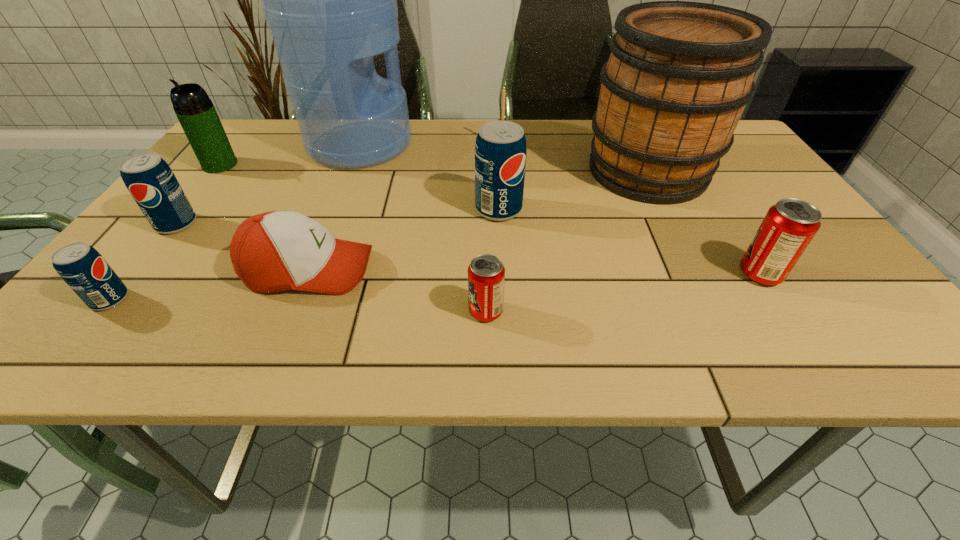
This screenshot has height=540, width=960. I want to click on the farther red soda can, so click(789, 226).

Find the location of a particular element. baseball cap is located at coordinates (274, 251).

In order to click on the smallest blue pop in this screenshot , I will do `click(82, 267)`.

At what (x,y) coordinates should I click in order to perform the action: click on the smaller red soda can. Please return your answer as a coordinate pair (x, y). The width and height of the screenshot is (960, 540). Looking at the image, I should click on (486, 274).

I want to click on the nearer red soda can, so click(486, 274).

I want to click on free space located 0.180m on the side of the water jug with the handle, so click(476, 144).

Where is `vacant space located on the left of the cider`? The width and height of the screenshot is (960, 540). vacant space located on the left of the cider is located at coordinates (434, 171).

This screenshot has width=960, height=540. In order to click on free location located from the spout of the eighth shortest object in this screenshot , I will do `click(193, 199)`.

Find the location of `free space located 0.290m on the right of the tallest soda can`. free space located 0.290m on the right of the tallest soda can is located at coordinates (647, 210).

Image resolution: width=960 pixels, height=540 pixels. Identify the location of blank area located 0.190m on the front of the candle_holder. (505, 190).